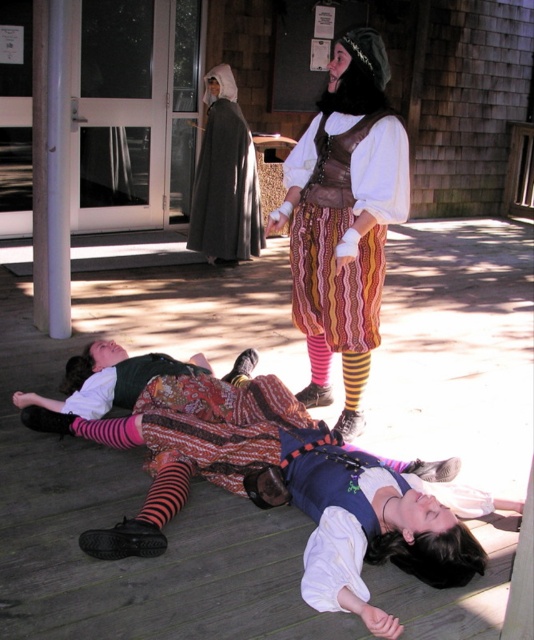
You are a costume designer assessing the scene. You need to determine which item has a greater width between the striped wool skirt at center and the pink striped sock at lower center. Which one is wider?

The striped wool skirt at center is wider than the pink striped sock at lower center according to the description.